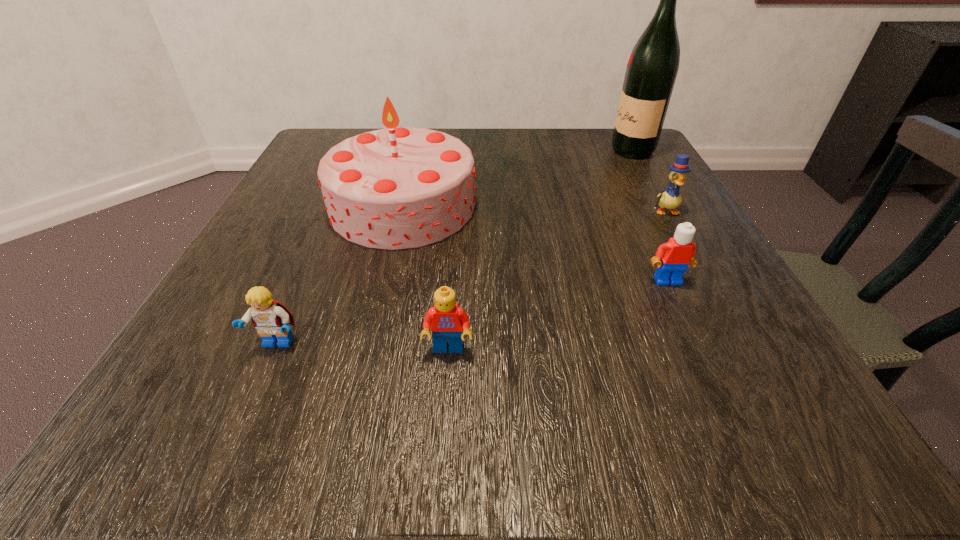
Find the location of a particular element. This screenshot has width=960, height=540. liquor present at the right edge is located at coordinates (653, 65).

Locate an element on the screen. duckling present at the right edge is located at coordinates (671, 198).

This screenshot has height=540, width=960. I want to click on Lego present at the right edge, so click(676, 255).

Locate an element on the screen. Image resolution: width=960 pixels, height=540 pixels. object located in the far left corner section of the desktop is located at coordinates (395, 188).

At what (x,y) coordinates should I click in order to perform the action: click on object that is at the far right corner. Please return your answer as a coordinate pair (x, y). The width and height of the screenshot is (960, 540). Looking at the image, I should click on (653, 65).

This screenshot has height=540, width=960. I want to click on vacant space at the far edge of the desktop, so point(513,139).

In order to click on free region at the near edge of the desktop in this screenshot , I will do point(527,397).

Where is `vacant space at the left edge`? vacant space at the left edge is located at coordinates (320, 221).

Locate an element on the screen. free space at the right edge of the desktop is located at coordinates (622, 189).

In the image, there is a desktop. Identify the location of vacant space at the far left corner. This screenshot has height=540, width=960. (349, 129).